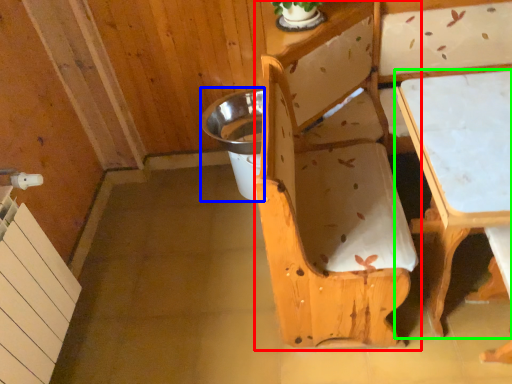
Question: Which is farther away from chair (highlighted by a red box)? potty (highlighted by a blue box) or table (highlighted by a green box)?

Choices:
 (A) potty
 (B) table

Answer: (A)